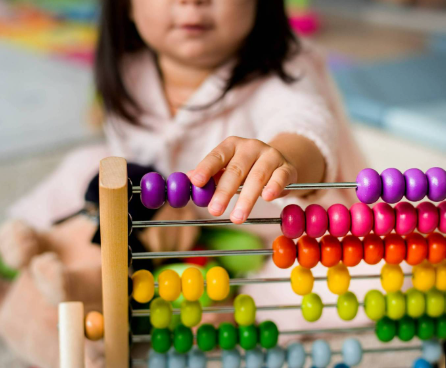
Locate an element on the screen. beads on the second rod from the top is located at coordinates (290, 218), (314, 223), (338, 225), (357, 218), (384, 218), (403, 220), (426, 217), (443, 220).